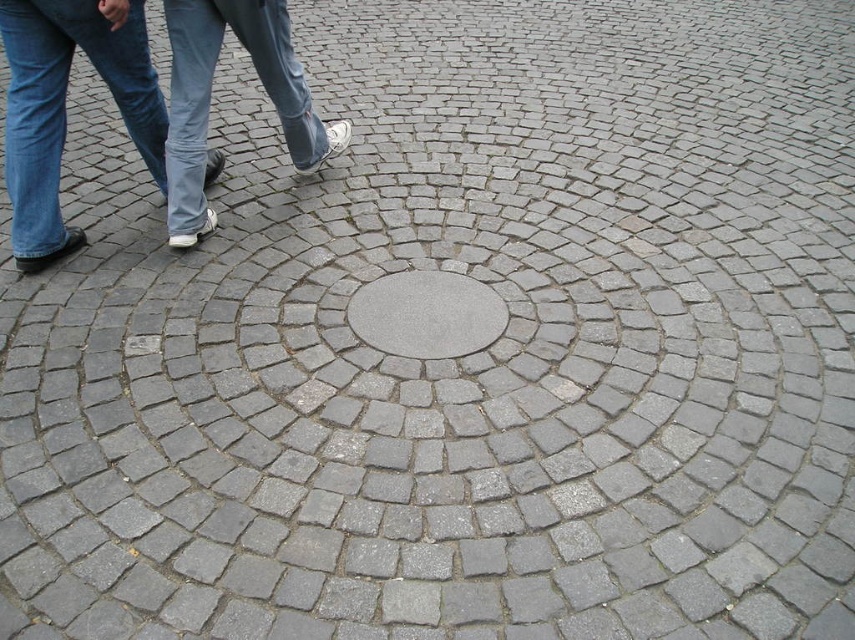
You are standing on the cobblestone pavement and see the white canvas shoe at center and the gray concrete manhole cover at center. Which object is higher in elevation?

The white canvas shoe at center is taller than the gray concrete manhole cover at center, so the white canvas shoe at center is higher in elevation.

You are standing on the cobblestone pavement and see a white canvas shoe at center and a gray concrete manhole cover at center. Which object is closer to you?

The white canvas shoe at center is located above the gray concrete manhole cover at center, so the white canvas shoe at center is closer to you.

You are a photographer trying to capture a shot of the cobblestone pavement. You notice the blue jeans at left and the white canvas shoe at center. Which object is closer to the central raised circle?

The white canvas shoe at center is closer to the central raised circle because the blue jeans at left is positioned on the left side of it, meaning the shoe is between the jeans and the center.